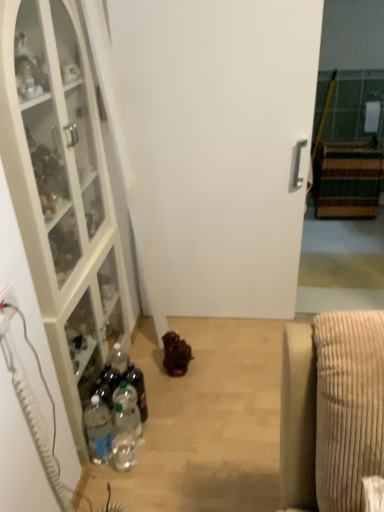
Locate an element on the screen. vacant space to the right of clear plastic bottle at lower left, marked as the second bottle in a right-to-left arrangement is located at coordinates (177, 436).